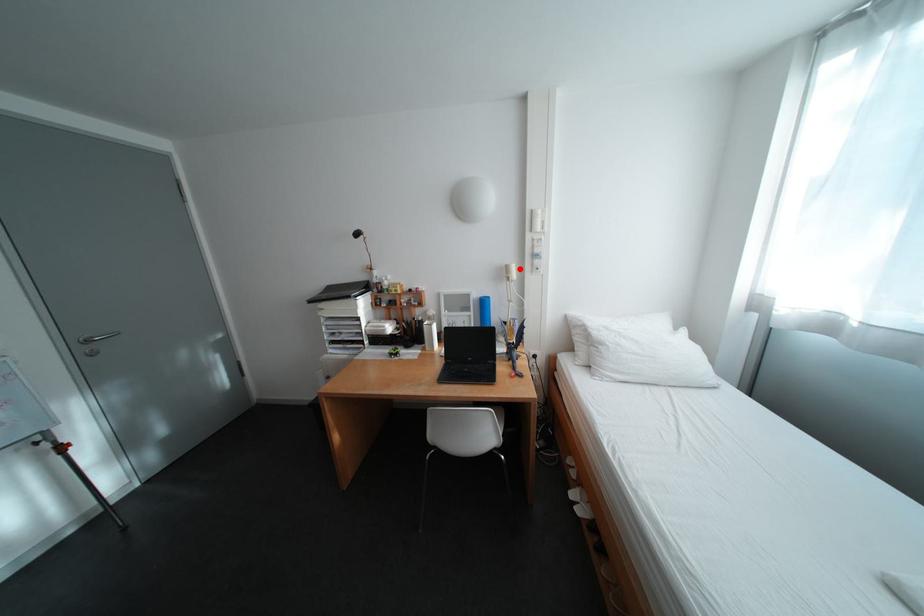
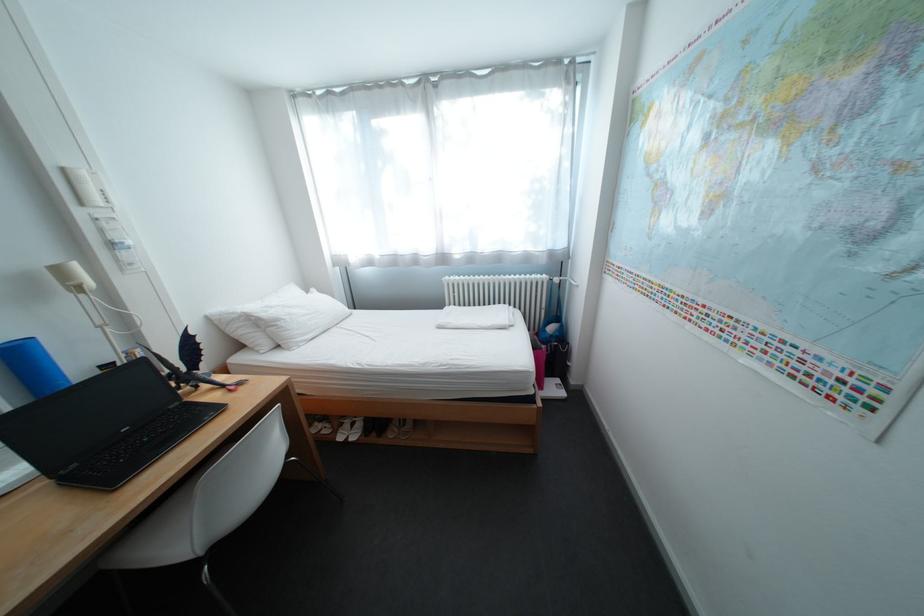
Locate, in the second image, the point that corresponds to the highlighted location in the first image.

(71, 272)